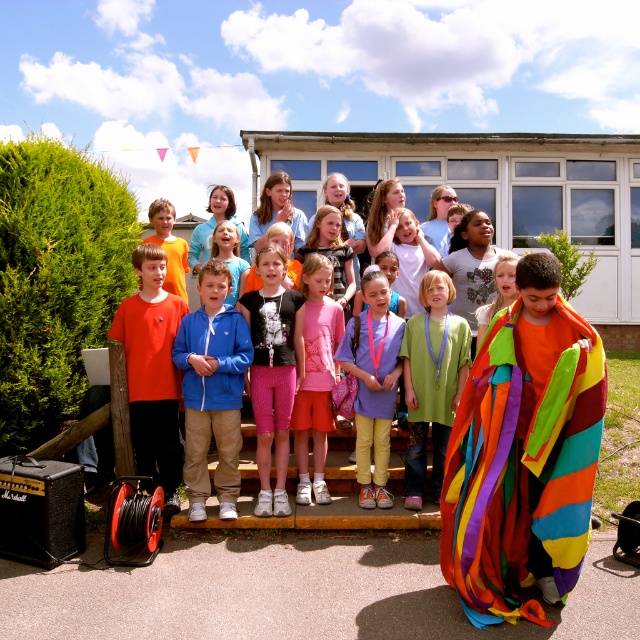
You are a photographer trying to capture both the matte orange shirt at left and the green fabric shirt at center in a single frame. Which shirt should you focus on first to ensure both are in the frame?

You should focus on the matte orange shirt at left first because it is bigger than the green fabric shirt at center, ensuring it fits within the frame while also capturing the smaller one.

You are a photographer trying to capture a group shot of the children. You want to ensure that both the blue fleece jacket at center and the rainbow fabric blanket at right are clearly visible in the photo. Based on their sizes, which object might require more space in the frame?

The blue fleece jacket at center might require more space in the frame since it is wider than the rainbow fabric blanket at right according to the description.

You are standing at the bottom of the steps where the children are posing. You want to walk towards the building. Which of the two points, point (204, 460) or point (429, 336), would you reach first?

You would reach point (204, 460) first because it is closer to you than point (429, 336).